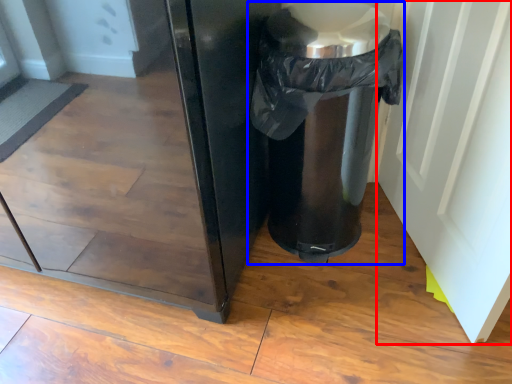
Question: Among these objects, which one is farthest to the camera, screen door (highlighted by a red box) or waste container (highlighted by a blue box)?

Choices:
 (A) screen door
 (B) waste container

Answer: (B)